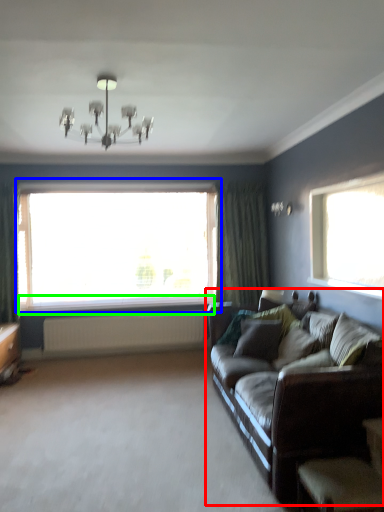
Question: Which is farther away from studio couch (highlighted by a red box)? window (highlighted by a blue box) or window sill (highlighted by a green box)?

Choices:
 (A) window
 (B) window sill

Answer: (B)